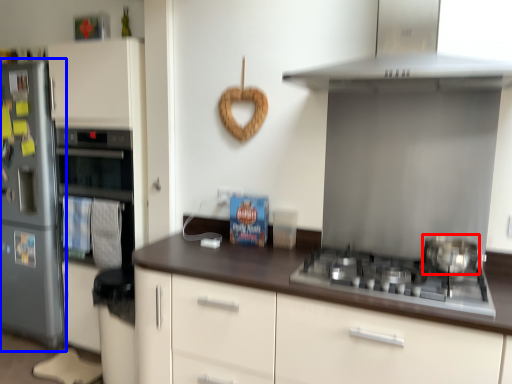
Question: Among these objects, which one is nearest to the camera, kitchen appliance (highlighted by a red box) or refrigerator (highlighted by a blue box)?

Choices:
 (A) kitchen appliance
 (B) refrigerator

Answer: (A)